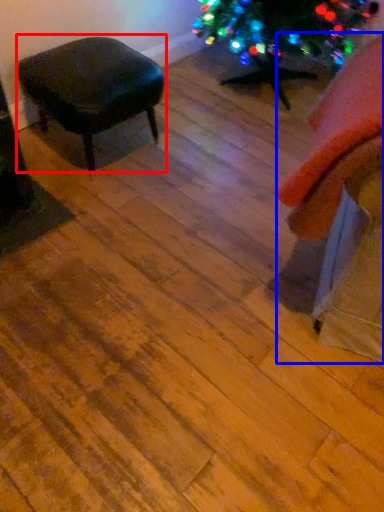
Question: Which object appears closest to the camera in this image, stool (highlighted by a red box) or swivel chair (highlighted by a blue box)?

Choices:
 (A) stool
 (B) swivel chair

Answer: (B)